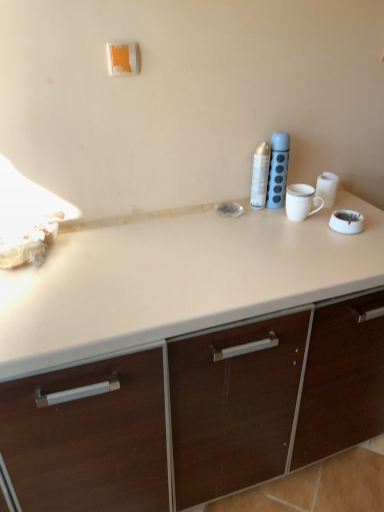
I want to click on white ceramic mug at upper right, so click(327, 188).

What do you see at coordinates (327, 188) in the screenshot? I see `white ceramic mug at upper right` at bounding box center [327, 188].

Locate an element on the screen. The height and width of the screenshot is (512, 384). white ceramic mug at upper right is located at coordinates (327, 188).